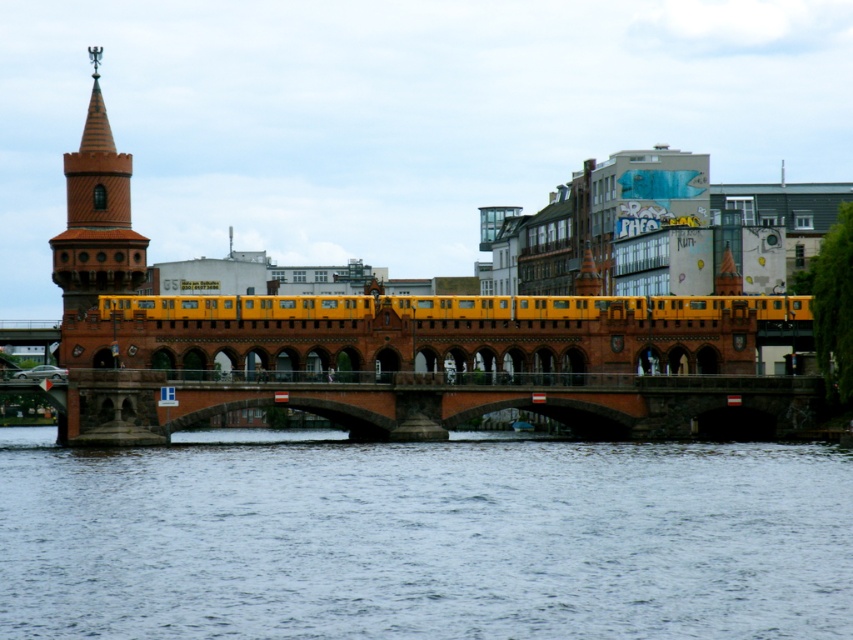
You are a city planner evaluating the space between the brick bridge at center and the brown brick tower at left for a new pedestrian walkway. Based on the scene, can you determine if there is enough space to place a 2 meter wide walkway between them?

The brick bridge at center might be wider than brown brick tower at left, so there may be sufficient space for a 2 meter wide walkway between them. However, exact measurements are needed to confirm.

You are a photographer planning to take a picture of the brick bridge at center and the yellow matte train at center from the shore. Based on their sizes in the image, which object would appear narrower in the photo?

The brick bridge at center is thinner than the yellow matte train at center, so it would appear narrower in the photo.

You are standing on the sidewalk near the historic bridge and want to cross it to reach the park on the other side. The brick bridge at center and brown brick tower at left are in your path. Which structure should you avoid to stay on the correct path towards the park?

You should avoid the brown brick tower at left because the brick bridge at center is to the right of it, so the correct path towards the park would be on the brick bridge at center.